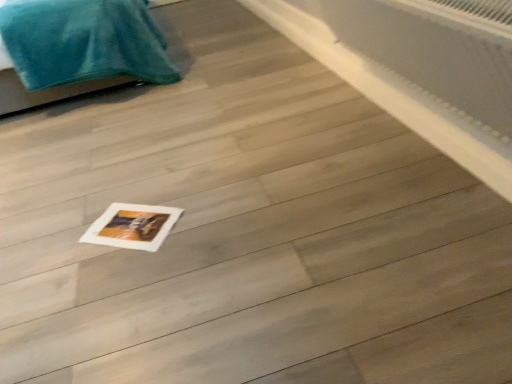
Locate an element on the screen. unoccupied space behind white glossy magazine at center is located at coordinates (x=141, y=189).